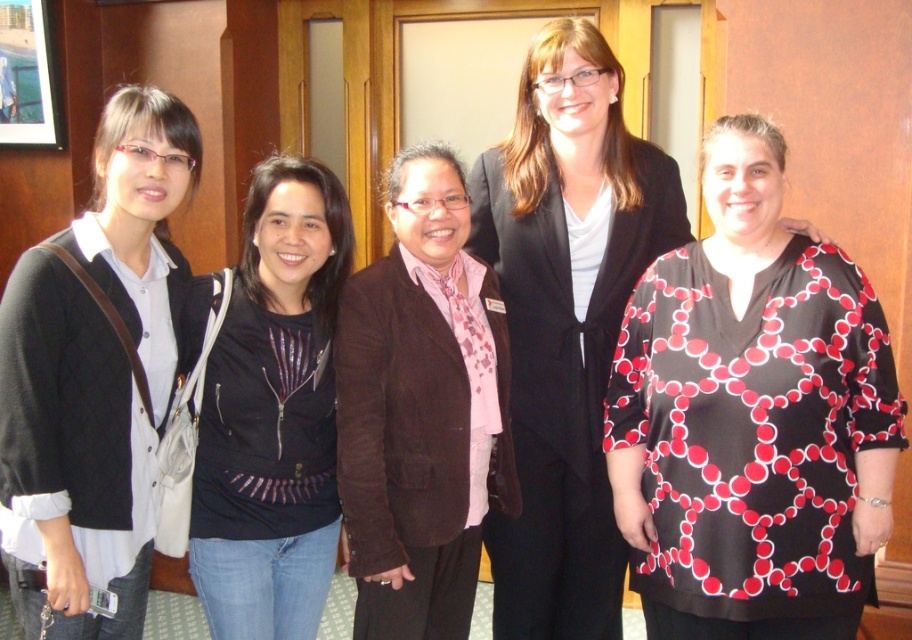
Consider the image. Is black textured blouse at center positioned at the back of black sequined jacket at center?

Yes, black textured blouse at center is behind black sequined jacket at center.

Is black textured blouse at center smaller than black sequined jacket at center?

No, black textured blouse at center is not smaller than black sequined jacket at center.

Does point (568, 124) lie in front of point (228, 460)?

No, it is not.

I want to click on black textured blouse at center, so click(566, 323).

Is black textured blouse at center thinner than black matte cardigan at left?

In fact, black textured blouse at center might be wider than black matte cardigan at left.

Which is below, black textured blouse at center or black matte cardigan at left?

black matte cardigan at left

Which is in front, point (604, 218) or point (140, 576)?

Point (140, 576)

This screenshot has height=640, width=912. Identify the location of black textured blouse at center. (566, 323).

Is black printed blouse at center taller than black textured blouse at center?

In fact, black printed blouse at center may be shorter than black textured blouse at center.

Does black printed blouse at center appear on the left side of black textured blouse at center?

In fact, black printed blouse at center is to the right of black textured blouse at center.

Is point (676, 321) positioned before point (553, 506)?

Yes.

Where is `black printed blouse at center`? The height and width of the screenshot is (640, 912). black printed blouse at center is located at coordinates (752, 419).